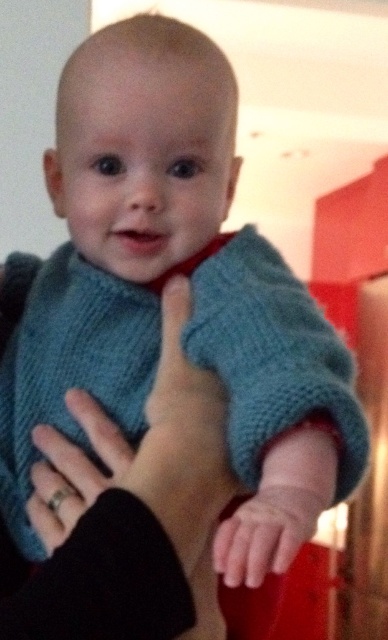
You are a baby in the image. Your hand is the smooth skin hand at center, and there is a silver metallic ring at lower left. Can you reach the ring with your hand?

The silver metallic ring at lower left is 20.09 centimeters away from the smooth skin hand at center. Since the average reach for a baby is about 15 centimeters, the baby cannot reach the ring.

You are a photographer setting up for a baby photo shoot. You notice the silver metallic ring at lower left and the smooth skin hand at center in the scene. Based on their positions, which object is closer to the left edge of the image?

The silver metallic ring at lower left is closer to the left edge of the image because it is positioned to the left of the smooth skin hand at center.

You are a photographer setting up for a baby photo shoot. You notice the silver metallic ring at lower left and the smooth skin hand at center in the scene. To ensure the baby stays focused on the hand, should you adjust the lighting to hide the ring? Explain why based on their positions.

The silver metallic ring at lower left is positioned under the smooth skin hand at center, so adjusting the lighting to hide the ring might not be necessary. The ring is already beneath the hand, making it less visible from the baby and photographer perspective. However, if the ring still distracts, slightly moving the hand or adjusting the angle could help without needing major lighting changes.